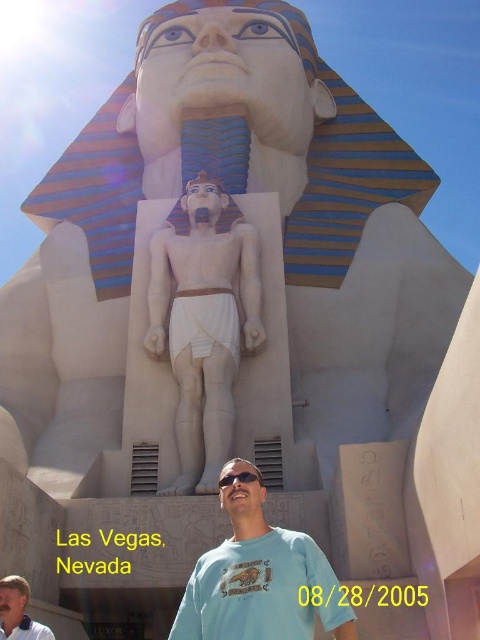
Question: Is white marble statue at center bigger than black plastic goggles at center?

Choices:
 (A) yes
 (B) no

Answer: (A)

Question: Which object is the farthest from the light blue t-shirt at lower center?

Choices:
 (A) light blue t-shirt at center
 (B) white marble statue at center

Answer: (B)

Question: Is the position of white marble statue at center less distant than that of light blue t-shirt at lower center?

Choices:
 (A) no
 (B) yes

Answer: (A)

Question: Considering the real-world distances, which object is closest to the light blue t-shirt at lower center?

Choices:
 (A) light blue t-shirt at center
 (B) white marble statue at center

Answer: (A)

Question: Considering the real-world distances, which object is farthest from the light blue t-shirt at lower center?

Choices:
 (A) light blue t-shirt at center
 (B) white marble statue at center

Answer: (B)

Question: Does light blue t-shirt at lower center appear on the left side of black plastic goggles at center?

Choices:
 (A) yes
 (B) no

Answer: (A)